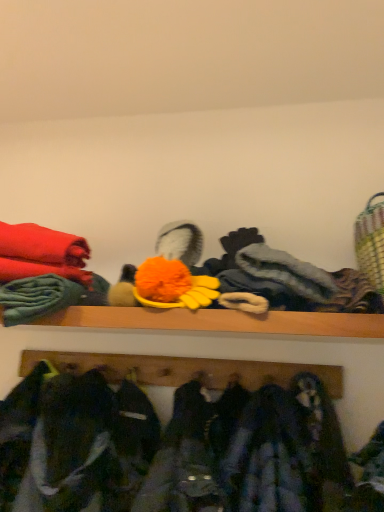
Question: From a real-world perspective, is wooden coat rack at lower center positioned above or below dark blue fabric at lower center?

Choices:
 (A) above
 (B) below

Answer: (A)

Question: Is wooden coat rack at lower center inside the boundaries of dark blue fabric at lower center, or outside?

Choices:
 (A) inside
 (B) outside

Answer: (B)

Question: In terms of width, does wooden coat rack at lower center look wider or thinner when compared to dark blue fabric at lower center?

Choices:
 (A) thin
 (B) wide

Answer: (A)

Question: Based on their sizes in the image, would you say dark blue fabric at lower center is bigger or smaller than wooden coat rack at lower center?

Choices:
 (A) big
 (B) small

Answer: (A)

Question: From their relative heights in the image, would you say dark blue fabric at lower center is taller or shorter than wooden coat rack at lower center?

Choices:
 (A) short
 (B) tall

Answer: (B)

Question: From the image's perspective, is dark blue fabric at lower center positioned above or below wooden coat rack at lower center?

Choices:
 (A) below
 (B) above

Answer: (A)

Question: From a real-world perspective, relative to wooden coat rack at lower center, is dark blue fabric at lower center vertically above or below?

Choices:
 (A) above
 (B) below

Answer: (B)